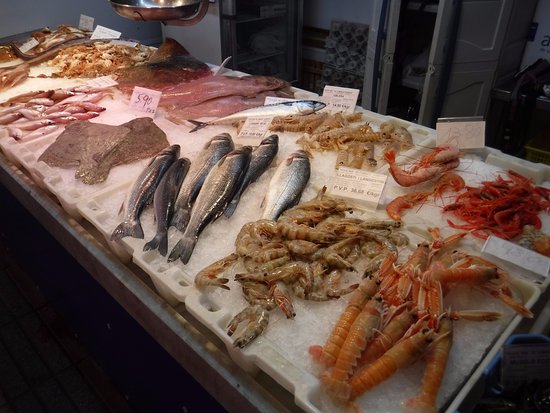
Where is `door`? door is located at coordinates (494, 26), (463, 69), (448, 106).